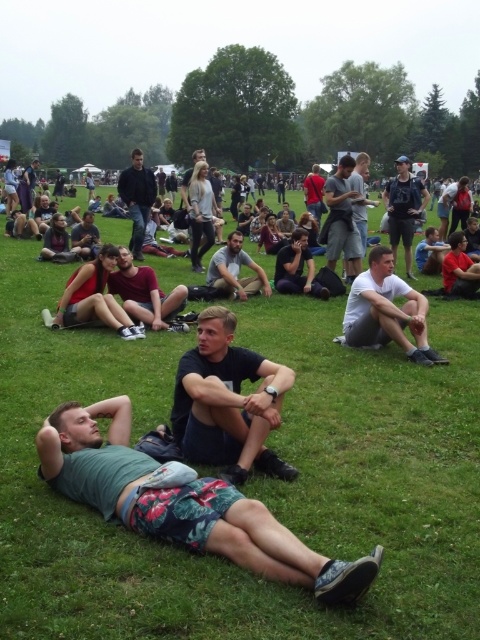
Based on the photo, you are a photographer trying to capture a candid shot of the dark gray casual pants at center and the light brown fabric pants at center. To ensure both are in frame, should you adjust your camera to focus on the left side or the right side first?

You should focus on the left side first because the dark gray casual pants at center are to the left of the light brown fabric pants at center.

You are standing at the origin point of the coordinate system in this park scene. You want to find the black matte shirt at center. What are the coordinates where you should look to locate it?

The black matte shirt at center is located at coordinates point (x=228, y=401).

You are organizing a group photo and need to arrange two people wearing the black matte shirt at center and the white cotton shirt at center so that their shirts are visible in the photo. Which shirt should be placed closer to the camera to ensure both shirts are clearly visible?

The black matte shirt at center is smaller than the white cotton shirt at center. To ensure both shirts are clearly visible, the smaller black matte shirt at center should be placed closer to the camera so that it appears larger in the photo, balancing the sizes of both shirts.